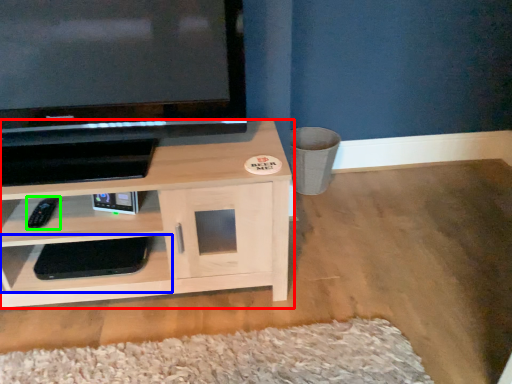
Question: Considering the real-world distances, which object is closest to shelf (highlighted by a red box)? shelf (highlighted by a blue box) or remote (highlighted by a green box).

Choices:
 (A) shelf
 (B) remote

Answer: (A)